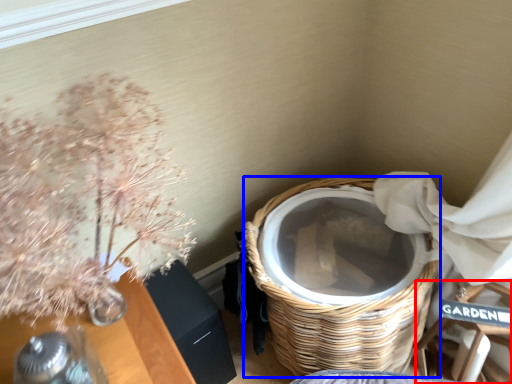
Question: Which object appears closest to the camera in this image, armchair (highlighted by a red box) or basket (highlighted by a blue box)?

Choices:
 (A) armchair
 (B) basket

Answer: (B)